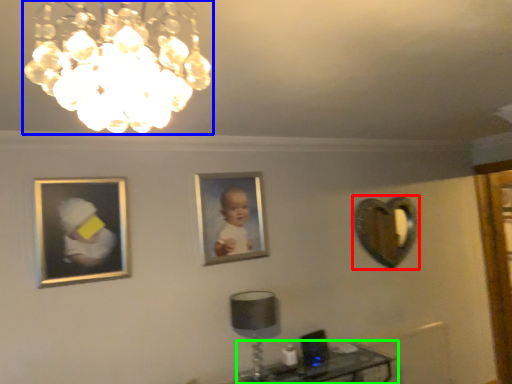
Question: Based on their relative distances, which object is nearer to mirror (highlighted by a red box)? Choose from lamp (highlighted by a blue box) and table (highlighted by a green box).

Choices:
 (A) lamp
 (B) table

Answer: (B)